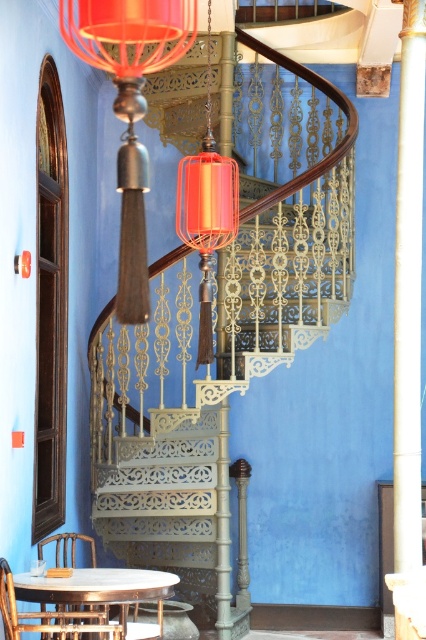
Question: Which of the following is the closest to the observer?

Choices:
 (A) (42, 554)
 (B) (34, 600)
 (C) (403, 449)
 (D) (126, 106)

Answer: (D)

Question: In this image, where is white glossy column at right located relative to wooden chair at lower left?

Choices:
 (A) left
 (B) right

Answer: (B)

Question: From the image, what is the correct spatial relationship of matte silver lamp at center in relation to white glossy column at right?

Choices:
 (A) right
 (B) left

Answer: (B)

Question: Which point is closer to the camera taking this photo?

Choices:
 (A) (406, 109)
 (B) (88, 586)
 (C) (37, 545)
 (D) (316, 104)

Answer: (B)

Question: Does metallic staircase at center have a smaller size compared to matte silver lamp at center?

Choices:
 (A) yes
 (B) no

Answer: (B)

Question: Which point appears closest to the camera in this image?

Choices:
 (A) (126, 579)
 (B) (423, 4)

Answer: (A)